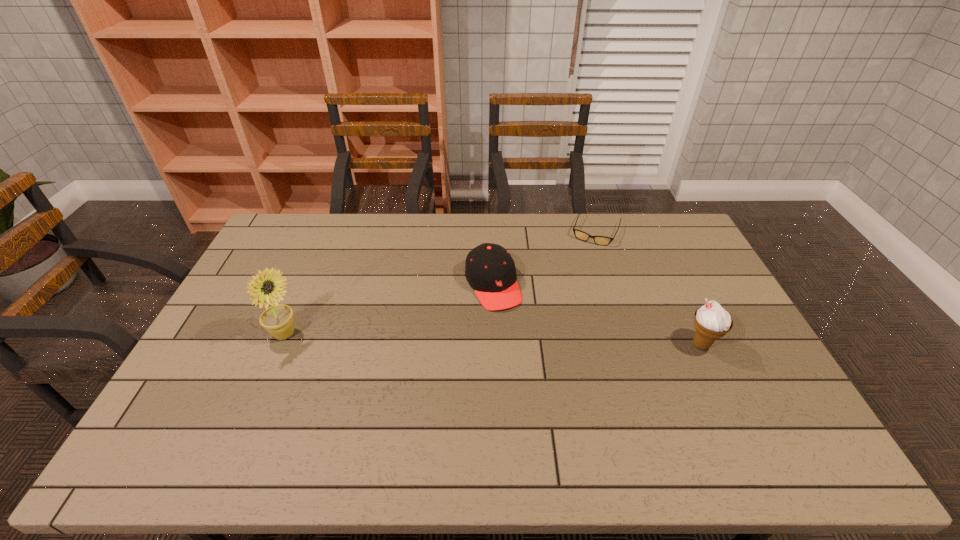
In order to click on free spot located 0.300m on the front-facing side of the third nearest object in this screenshot , I will do `click(542, 388)`.

Where is `vacant space located on the front-facing side of the third nearest object`? The image size is (960, 540). vacant space located on the front-facing side of the third nearest object is located at coordinates (515, 334).

At what (x,y) coordinates should I click in order to perform the action: click on free region located on the front-facing side of the third nearest object. Please return your answer as a coordinate pair (x, y). Image resolution: width=960 pixels, height=540 pixels. Looking at the image, I should click on (518, 341).

Image resolution: width=960 pixels, height=540 pixels. Find the location of `free space located on the front-facing side of the farthest object`. free space located on the front-facing side of the farthest object is located at coordinates (574, 282).

I want to click on free space located 0.110m on the front-facing side of the farthest object, so click(583, 263).

This screenshot has width=960, height=540. Find the location of `vacant space located on the front-facing side of the farthest object`. vacant space located on the front-facing side of the farthest object is located at coordinates (569, 294).

Where is `object located at the far edge`? The width and height of the screenshot is (960, 540). object located at the far edge is located at coordinates (583, 236).

Find the location of `object that is at the right edge`. object that is at the right edge is located at coordinates (711, 321).

Locate an element on the screen. free space at the far edge is located at coordinates (543, 217).

This screenshot has height=540, width=960. In the image, there is a desktop. What are the coordinates of `free space at the near edge` in the screenshot? It's located at (429, 406).